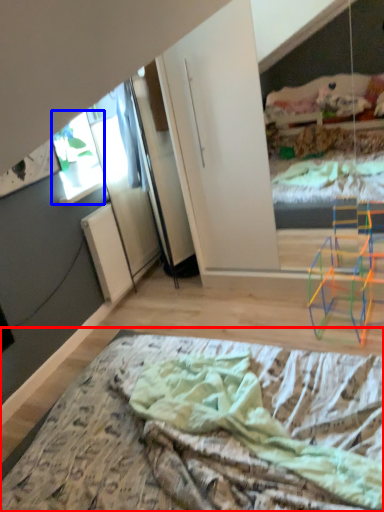
Question: Among these objects, which one is nearest to the camera, bed (highlighted by a red box) or window (highlighted by a blue box)?

Choices:
 (A) bed
 (B) window

Answer: (A)